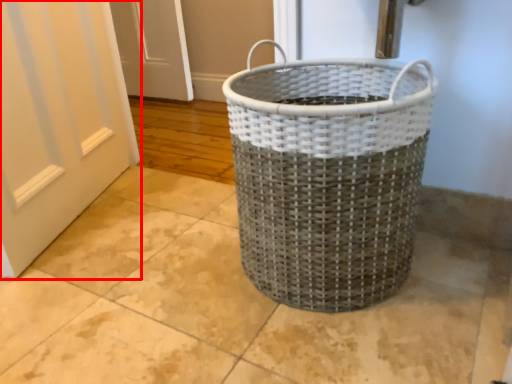
Question: From the image's perspective, what is the correct spatial positioning of door (annotated by the red box) in reference to waste container?

Choices:
 (A) above
 (B) below

Answer: (A)